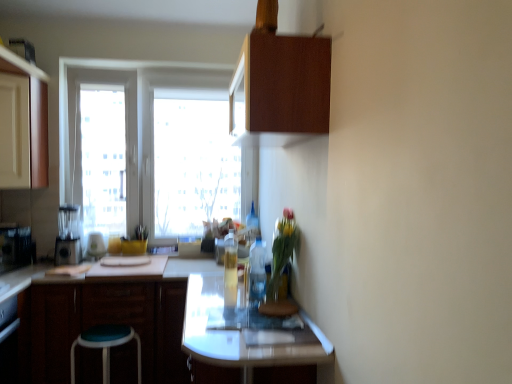
Identify the location of free region under matte black blender at left, which is counted as the 2th appliance, starting from the right (from a real-world perspective). (71, 263).